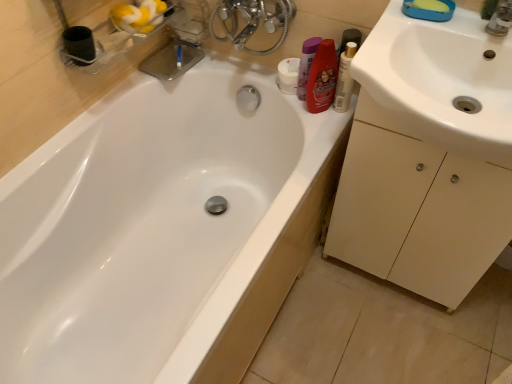
At what (x,y) coordinates should I click in order to perform the action: click on vacant space that is to the left of shiny plastic shampoo bottle at upper center, which is counted as the 3th toiletry, starting from the right. Please return your answer as a coordinate pair (x, y). This screenshot has width=512, height=384. Looking at the image, I should click on (247, 71).